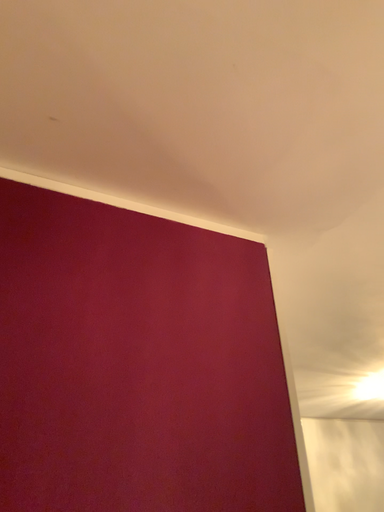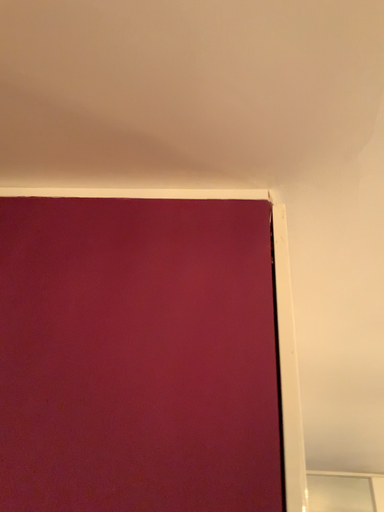
Question: Which way did the camera rotate in the video?

Choices:
 (A) rotated left
 (B) rotated right

Answer: (A)